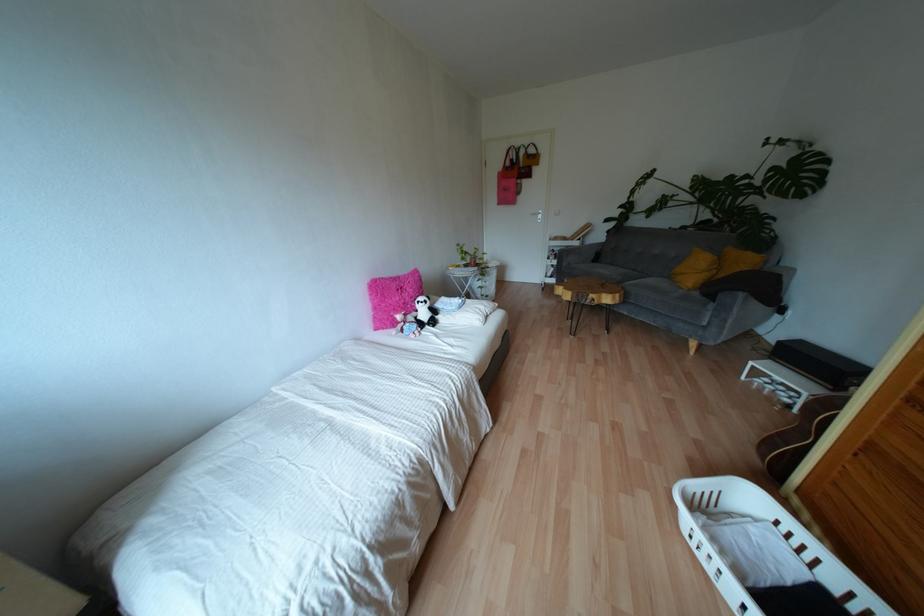
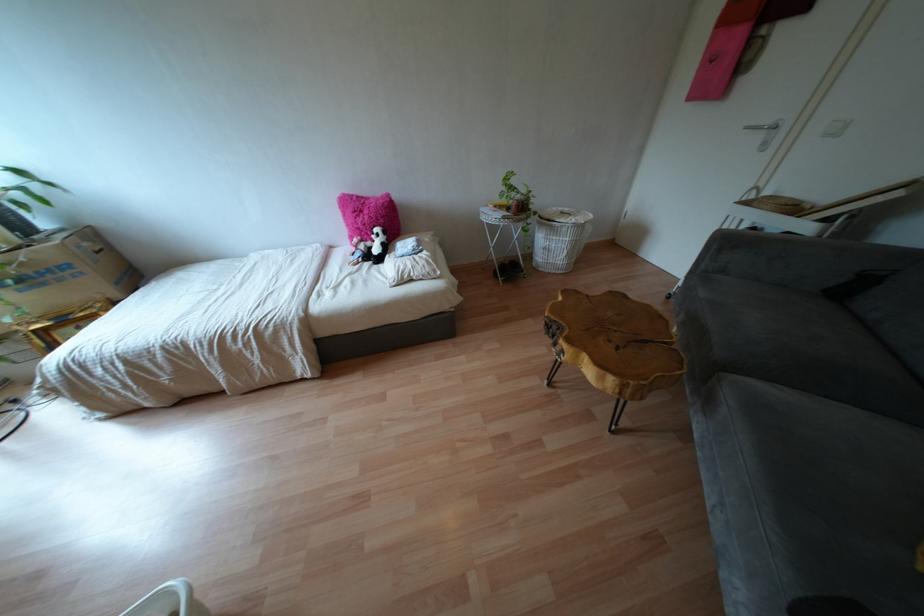
The point at (560, 254) is marked in the first image. Where is the corresponding point in the second image?

(723, 243)